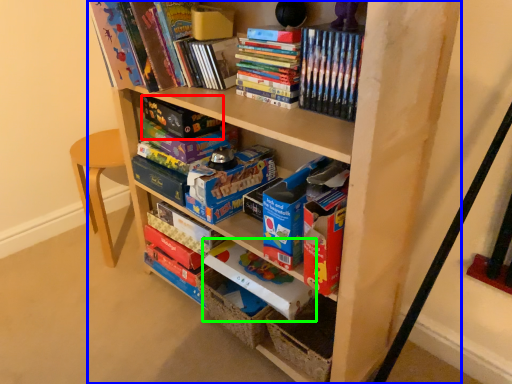
Question: Considering the real-world distances, which object is closest to paperback book (highlighted by a red box)? shelf (highlighted by a blue box) or paperback book (highlighted by a green box).

Choices:
 (A) shelf
 (B) paperback book

Answer: (B)